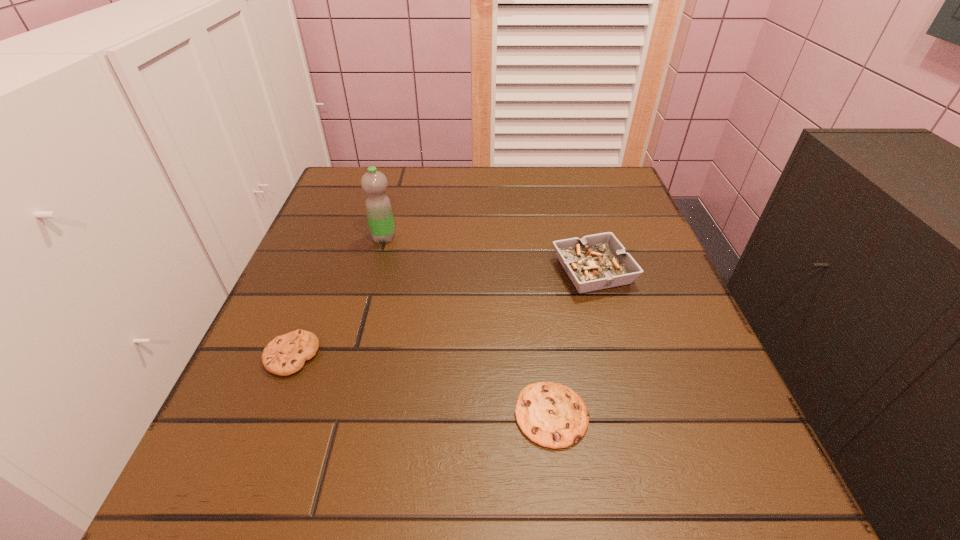
What are the coordinates of `unoccupied area between the right cookie and the third tallest object` in the screenshot? It's located at pos(421,386).

I want to click on the second closest object to the shorter cookie, so click(x=286, y=354).

Find the location of `object that is the third closest one to the nearer cookie`. object that is the third closest one to the nearer cookie is located at coordinates (378, 206).

Where is `blank area in the image that satisfies the following two spatial constraints: 1. on the front side of the nearest object; 2. on the right side of the second nearest object`? blank area in the image that satisfies the following two spatial constraints: 1. on the front side of the nearest object; 2. on the right side of the second nearest object is located at coordinates (269, 415).

Find the location of `free space that satisfies the following two spatial constraints: 1. on the back side of the farthest object; 2. on the right side of the farther cookie`. free space that satisfies the following two spatial constraints: 1. on the back side of the farthest object; 2. on the right side of the farther cookie is located at coordinates (339, 238).